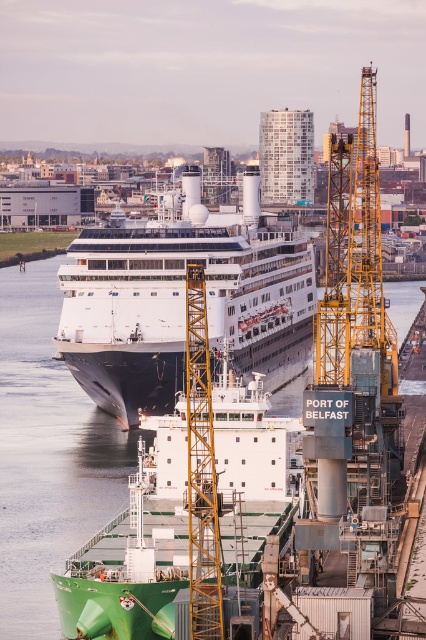
You are a port authority official assessing the port layout. You observe the white glossy cruise ship at center and the clear water at center. Which of these two has a greater width in the image?

The clear water at center has a greater width than the white glossy cruise ship at center according to the description.

You are a port authority inspector tasked with ensuring safe navigation. You observe the white glossy cruise ship at center and the clear water at center. Which object is located to the right of the other?

The white glossy cruise ship at center is positioned on the right side of clear water at center, so the cruise ship is to the right of the clear water.

You are a port supervisor checking the layout of the port. You see the clear water at center and the yellow metallic crane at right. Which object is positioned to the right side of the other?

The yellow metallic crane at right is positioned to the right of the clear water at center.